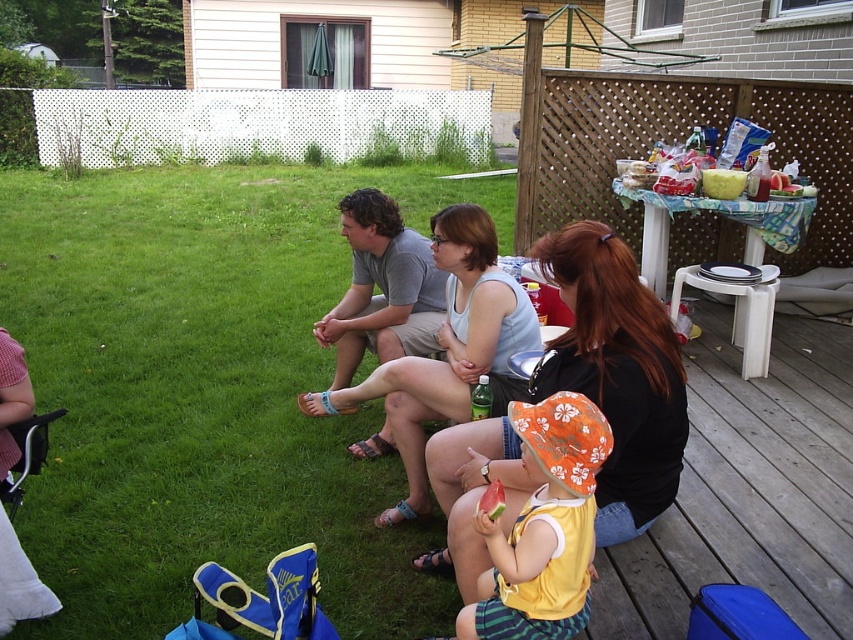
You are planning to set up a picnic blanket in the backyard. The green grass at lower left and the yellow cotton shirt at lower center are both visible from where you stand. Which area would be more suitable for placing the picnic blanket based on their heights?

The yellow cotton shirt at lower center is shorter than the green grass at lower left, so placing the picnic blanket there would be more suitable as it is less obstructed by tall grass.

You are at the outdoor gathering and want to greet the person wearing the matte black tank top at center. Which direction should you move relative to the gray cotton shirt at center?

You should move to the right of the gray cotton shirt at center to reach the matte black tank top at center.

What is located at the point with coordinates [202,390] in the image?

The point at coordinates [202,390] is occupied by the green grass at lower left.